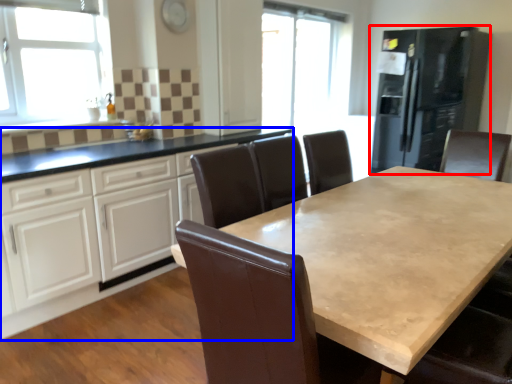
Question: Among these objects, which one is nearest to the camera, fridge (highlighted by a red box) or cabinetry (highlighted by a blue box)?

Choices:
 (A) fridge
 (B) cabinetry

Answer: (B)